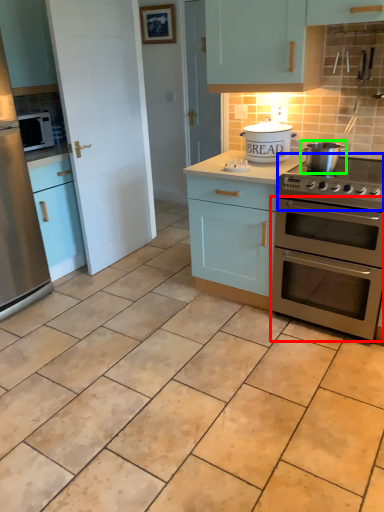
Question: Which is farther away from oven (highlighted by a red box)? gas stove (highlighted by a blue box) or appliance (highlighted by a green box)?

Choices:
 (A) gas stove
 (B) appliance

Answer: (B)